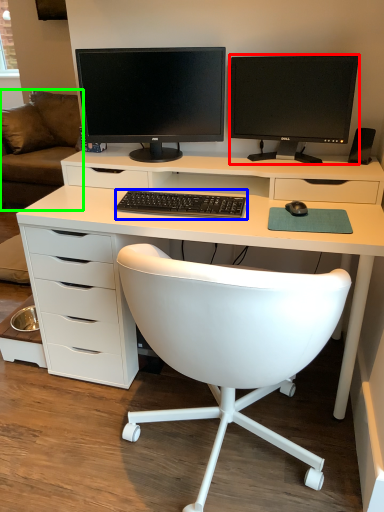
Question: Considering the real-world distances, which object is closest to computer monitor (highlighted by a red box)? computer keyboard (highlighted by a blue box) or couch (highlighted by a green box).

Choices:
 (A) computer keyboard
 (B) couch

Answer: (A)